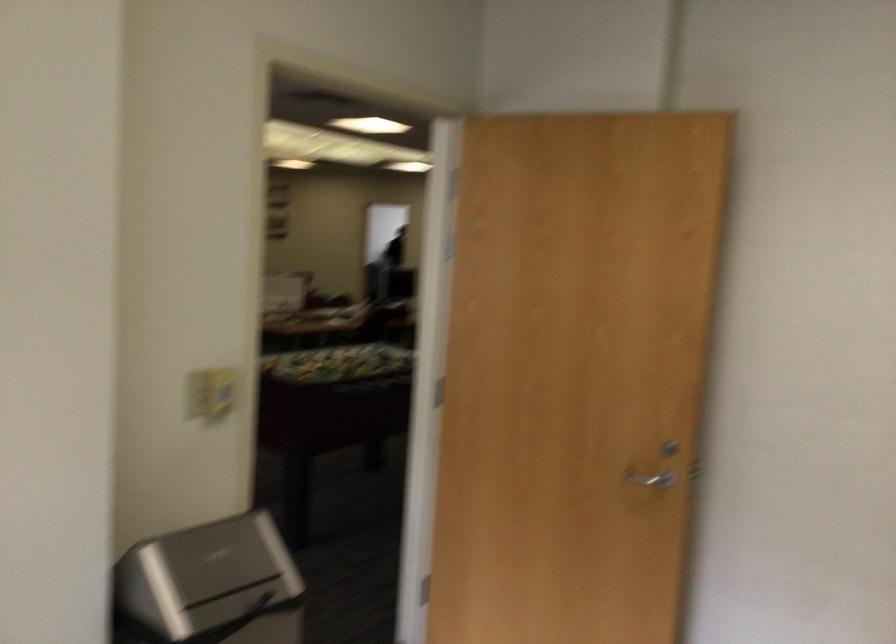
Where is `light switch`? The height and width of the screenshot is (644, 896). light switch is located at coordinates (209, 393).